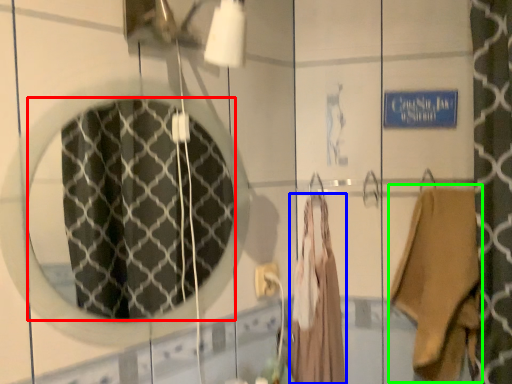
Question: Which object is the farthest from mirror (highlighted by a red box)? Choose among these: clothing (highlighted by a blue box) or clothing (highlighted by a green box).

Choices:
 (A) clothing
 (B) clothing

Answer: (B)